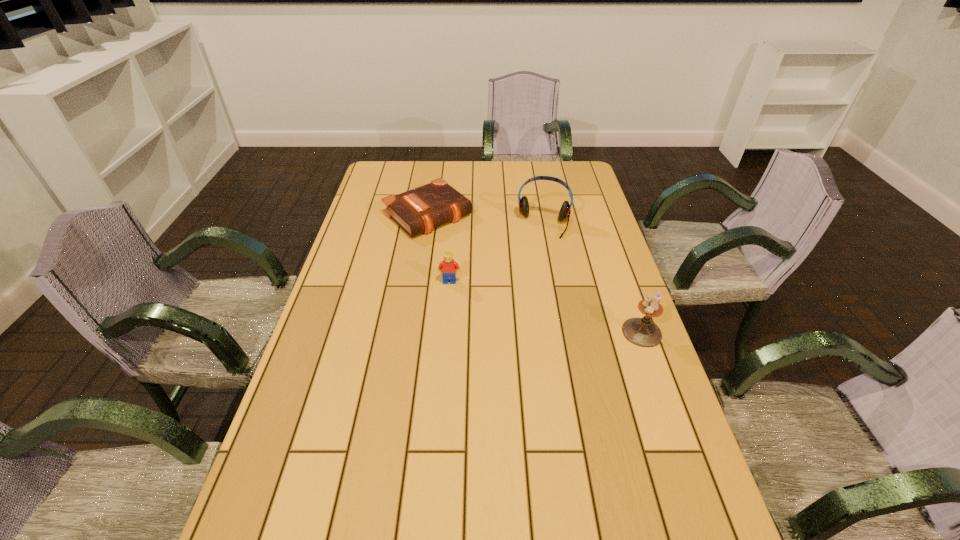
Locate an element on the screen. The width and height of the screenshot is (960, 540). vacant spot on the desktop that is between the second nearest object and the rightmost object and is positioned with the microphone attached to the side of the headset is located at coordinates (529, 302).

The width and height of the screenshot is (960, 540). I want to click on free space on the desktop that is between the second shortest object and the nearest object and is positioned on the spine side of the shortest object, so click(528, 302).